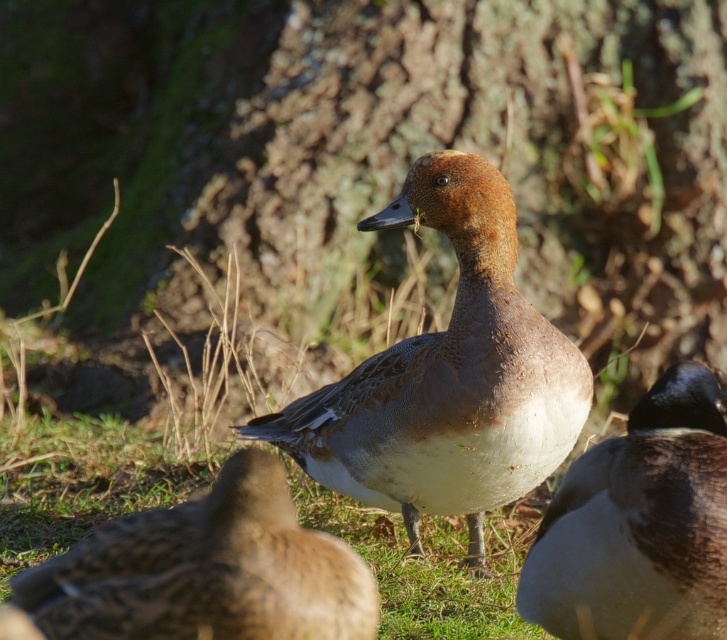
You are a photographer trying to capture the brown speckled duck at center. You notice a point marked at coordinates (x=204, y=572). Where is this point located in relation to the duck?

The point at coordinates (x=204, y=572) corresponds to the brown speckled duck at center, so it is located exactly at the duck.

You are an ornithologist observing two ducks in the image. You need to determine which one is wider. The scene shows a brown feathered duck at center and a brown matte duck at center. Which duck has a greater width?

The brown feathered duck at center has a greater width than the brown matte duck at center.

You are a wildlife photographer aiming to capture the brown feathered duck at center in your shot. Your camera is currently focused at point coordinates of 0.5, 0.5. Do you need to adjust the focus point to ensure the duck is centered in your photo?

The brown feathered duck at center is located at point coordinates of [446,378], which is slightly off the current focus point of [363,320]. To center the duck in your photo, you should adjust the focus point to its current coordinates.